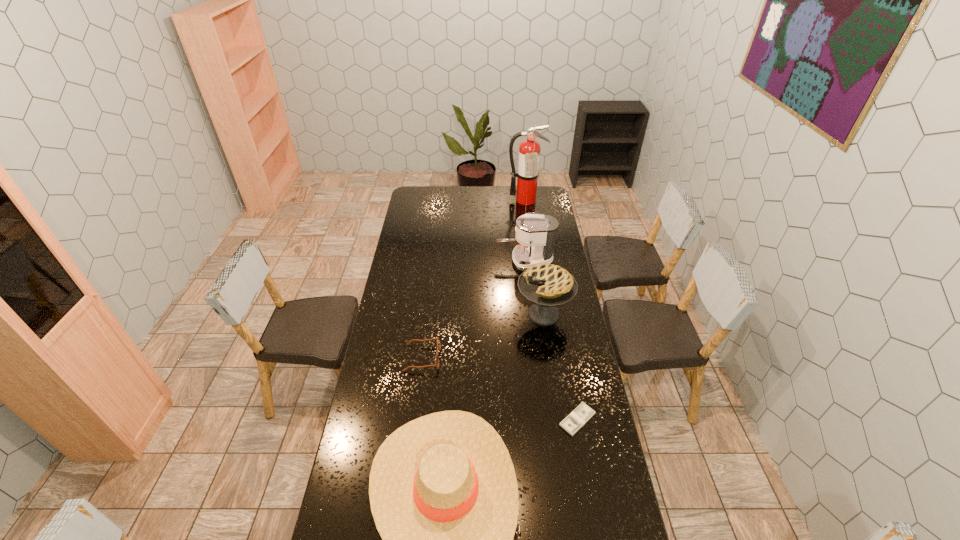
At what (x,y) coordinates should I click in order to perform the action: click on free space between the tallest object and the fourth farthest object. Please return your answer as a coordinate pair (x, y). This screenshot has width=960, height=540. Looking at the image, I should click on (474, 279).

Identify the location of empty space that is in between the coffee maker and the dollar. (551, 340).

The image size is (960, 540). Identify the location of free space that is in between the third nearest object and the second farthest object. (473, 309).

This screenshot has height=540, width=960. I want to click on free space that is in between the shortest object and the coffee maker, so point(551,340).

Find the location of a particular element. This screenshot has width=960, height=540. the third closest object to the third shortest object is located at coordinates (547, 286).

Locate an element on the screen. object that stands as the closest to the sunhat is located at coordinates (582, 414).

The height and width of the screenshot is (540, 960). Find the location of `vacant area that satisfies the following two spatial constraints: 1. on the back side of the dollar; 2. on the front-facing side of the fifth nearest object`. vacant area that satisfies the following two spatial constraints: 1. on the back side of the dollar; 2. on the front-facing side of the fifth nearest object is located at coordinates [x=548, y=261].

You are a GUI agent. You are given a task and a screenshot of the screen. Output one action in this format:
    pyautogui.click(x=<x>, y=<y>)
    Task: Click on the free spot that satisfies the following two spatial constraints: 1. on the front-facing side of the third nearest object; 2. on the left side of the shortest object
    The image size is (960, 540).
    Given the screenshot: What is the action you would take?
    pyautogui.click(x=415, y=420)

Identify the location of vacant space that satisfies the following two spatial constraints: 1. on the nozzle side of the farthest object; 2. on the front-facing side of the coffee maker. The width and height of the screenshot is (960, 540). (535, 261).

Locate an element on the screen. free space that satisfies the following two spatial constraints: 1. on the front-facing side of the shortest object; 2. on the right side of the third nearest object is located at coordinates (415, 420).